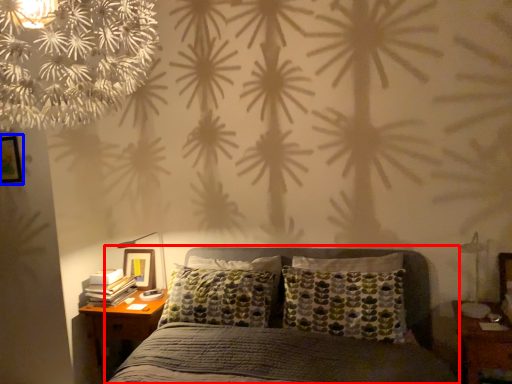
Question: Among these objects, which one is nearest to the camera, bed (highlighted by a red box) or picture frame (highlighted by a blue box)?

Choices:
 (A) bed
 (B) picture frame

Answer: (A)